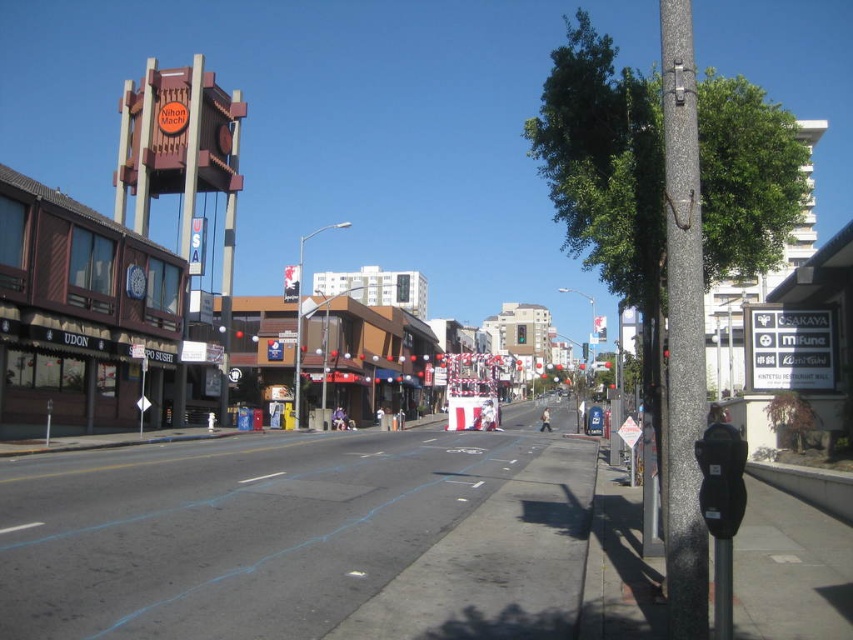
You are a delivery person who needs to park your bike between the granite pole at right and the black plastic parking meter at right. Which object should you position your bike closer to if you want to maximize the space between your bike and the other objects?

Since the granite pole at right is larger in size than the black plastic parking meter at right, positioning your bike closer to the larger granite pole at right would create more space between the bike and the smaller black plastic parking meter at right.